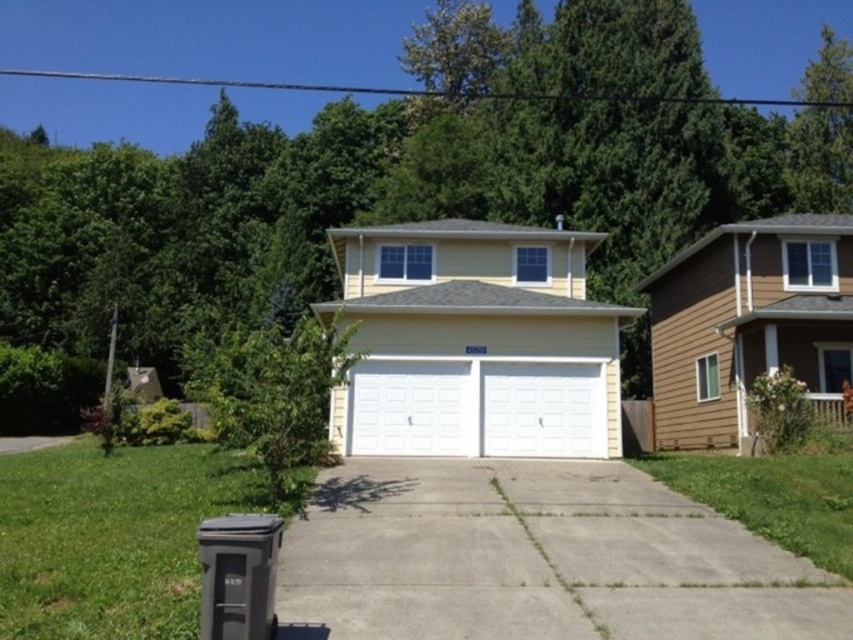
Question: From the image, what is the correct spatial relationship of gray concrete driveway at center in relation to white painted wood garage doors at center?

Choices:
 (A) right
 (B) left

Answer: (A)

Question: Does gray concrete driveway at center appear on the left side of brown wood siding garage at right?

Choices:
 (A) yes
 (B) no

Answer: (A)

Question: Which point appears closest to the camera in this image?

Choices:
 (A) (19, 445)
 (B) (517, 419)

Answer: (B)

Question: Which object is closer to the camera taking this photo?

Choices:
 (A) white textured garage door at center
 (B) brown wood siding garage at right
 (C) gray concrete driveway at lower left

Answer: (A)

Question: Which point is farther from the camera taking this photo?

Choices:
 (A) (840, 256)
 (B) (433, 440)

Answer: (A)

Question: Does gray concrete driveway at center appear over brown wood siding garage at right?

Choices:
 (A) no
 (B) yes

Answer: (A)